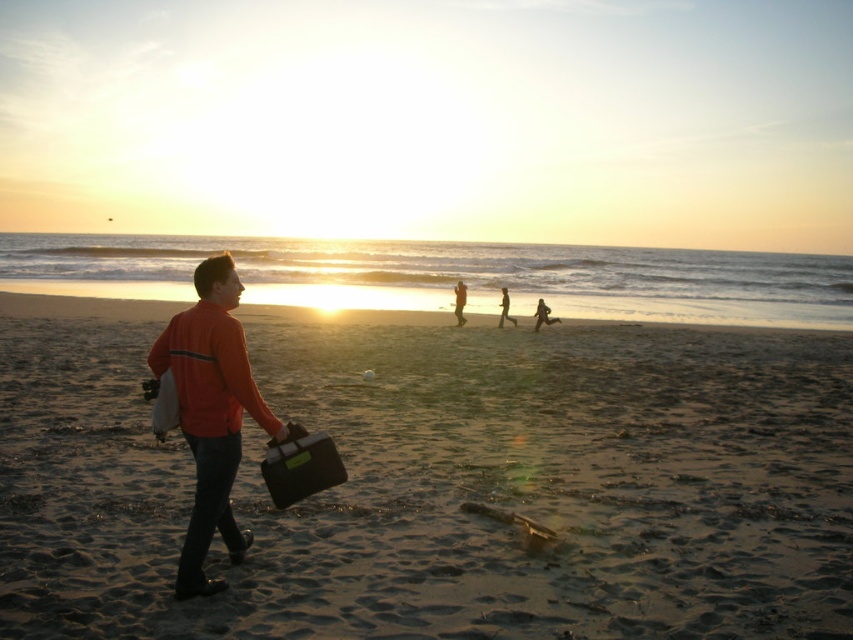
Can you confirm if orange matte jacket at center is taller than orange fabric pants at center?

Indeed, orange matte jacket at center has a greater height compared to orange fabric pants at center.

Is orange matte jacket at center positioned before orange fabric pants at center?

Yes, orange matte jacket at center is closer to the viewer.

The height and width of the screenshot is (640, 853). Describe the element at coordinates (212, 412) in the screenshot. I see `orange matte jacket at center` at that location.

Where is `orange matte jacket at center`? orange matte jacket at center is located at coordinates (212, 412).

Which of these two, sandy brown at center or orange fabric pants at center, stands taller?

sandy brown at center is taller.

Who is more distant from viewer, (x=167, y=445) or (x=462, y=285)?

Point (x=462, y=285)

This screenshot has width=853, height=640. What are the coordinates of `sandy brown at center` in the screenshot? It's located at (437, 481).

The width and height of the screenshot is (853, 640). What are the coordinates of `sandy brown at center` in the screenshot? It's located at (437, 481).

Between sandy brown at center and orange matte jacket at center, which one appears on the left side from the viewer's perspective?

From the viewer's perspective, orange matte jacket at center appears more on the left side.

Where is `sandy brown at center`? sandy brown at center is located at coordinates (437, 481).